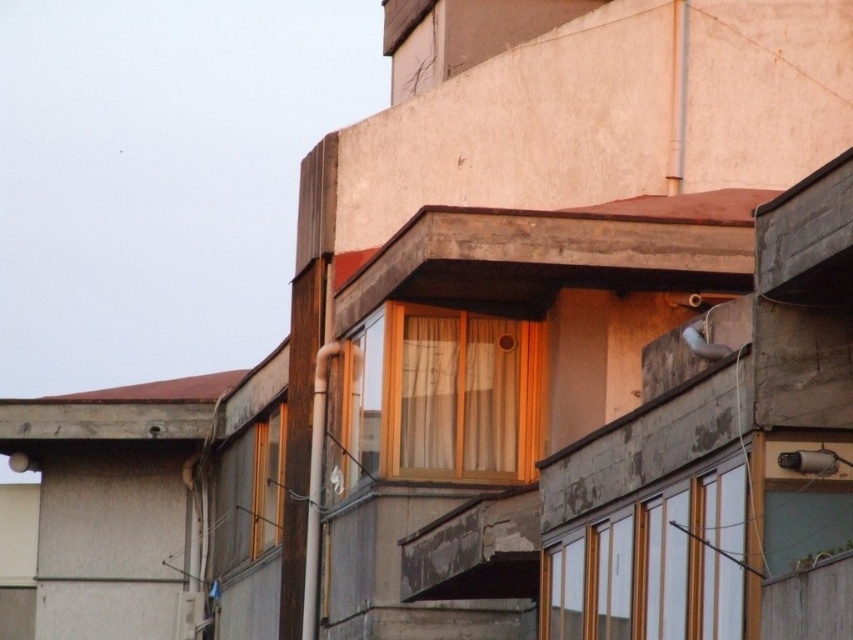
You are standing outside the building looking at the second floor window. There is a point marked at coordinates (653, 561). What object is located at that point?

The point at coordinates (653, 561) indicates a white matte window at center.

Consider the image. You are a window installer who needs to replace both the white matte window at center and the wooden frame window at center. Given that your ladder can only reach up to 120 feet, can you safely reach both windows from the same spot on the ground?

The white matte window at center and wooden frame window at center are 130.90 feet apart. Since your ladder can only reach up to 120 feet, you cannot safely reach both windows from the same spot on the ground because the distance between them exceeds the ladder capacity.